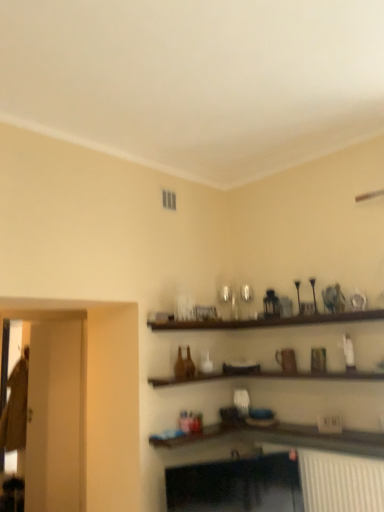
Question: In terms of size, does transparent glass door at left, the 2th glass door when ordered from front to back, appear bigger or smaller than transparent glass door at left, the second glass door in the left-to-right sequence?

Choices:
 (A) small
 (B) big

Answer: (B)

Question: Which is correct: transparent glass door at left, the 2th glass door when ordered from front to back, is inside transparent glass door at left, the 1th glass door in the right-to-left sequence, or outside of it?

Choices:
 (A) inside
 (B) outside

Answer: (B)

Question: From a real-world perspective, is transparent glass door at left, the 1th glass door from the back, positioned above or below transparent glass door at left, the second glass door in the left-to-right sequence?

Choices:
 (A) above
 (B) below

Answer: (B)

Question: From the image's perspective, is transparent glass door at left, the 1th glass door in the right-to-left sequence, positioned above or below transparent glass door at left, the 1th glass door from the back?

Choices:
 (A) below
 (B) above

Answer: (B)

Question: Considering the relative positions of transparent glass door at left, which is the 1th glass door in front-to-back order, and transparent glass door at left, positioned as the second glass door in right-to-left order, in the image provided, is transparent glass door at left, which is the 1th glass door in front-to-back order, to the left or to the right of transparent glass door at left, positioned as the second glass door in right-to-left order,?

Choices:
 (A) right
 (B) left

Answer: (A)

Question: Is point (67, 506) closer or farther from the camera than point (14, 436)?

Choices:
 (A) farther
 (B) closer

Answer: (B)

Question: In the image, is transparent glass door at left, which is the 1th glass door in front-to-back order, positioned in front of or behind transparent glass door at left, positioned as the second glass door in right-to-left order?

Choices:
 (A) front
 (B) behind

Answer: (A)